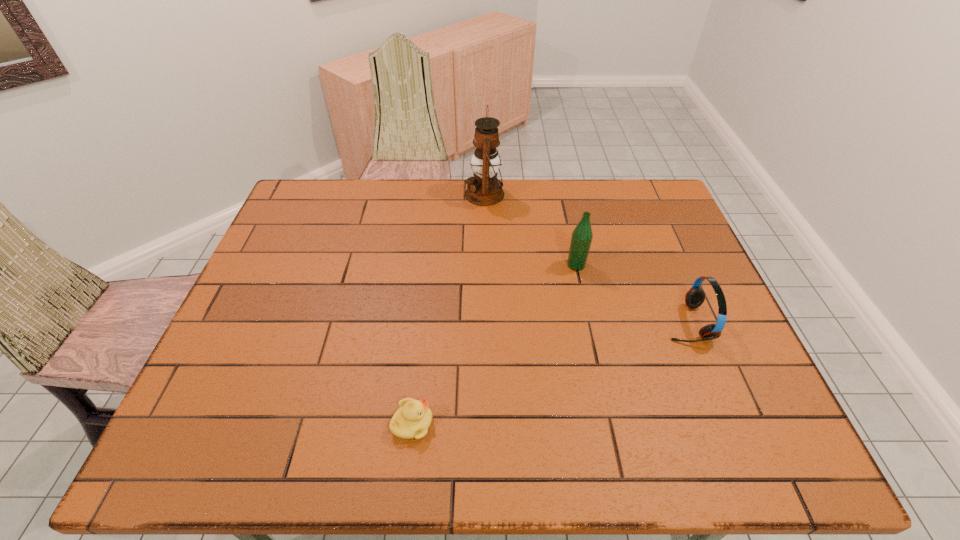
Image resolution: width=960 pixels, height=540 pixels. What are the coordinates of `free spot between the second object from right to left and the third tallest object` in the screenshot? It's located at (631, 294).

Identify the location of free space between the second farthest object and the headset. 631,294.

Where is `the third closest object to the leftmost object`? This screenshot has width=960, height=540. the third closest object to the leftmost object is located at coordinates (484, 189).

Identify which object is located as the nearest to the lantern. Please provide its 2D coordinates. Your answer should be formatted as a tuple, i.e. [(x, y)], where the tuple contains the x and y coordinates of a point satisfying the conditions above.

[(581, 239)]

I want to click on free space in the image that satisfies the following two spatial constraints: 1. on the side of the farthest object, there is a wick adjustment knob; 2. on the left side of the second tallest object, so click(x=486, y=265).

Locate an element on the screen. The image size is (960, 540). free location that satisfies the following two spatial constraints: 1. on the back side of the bottle; 2. on the side of the lantern, there is a wick adjustment knob is located at coordinates (561, 194).

Where is `free space that satisfies the following two spatial constraints: 1. on the side of the lantern, there is a wick adjustment knob; 2. on the right side of the third shortest object`? free space that satisfies the following two spatial constraints: 1. on the side of the lantern, there is a wick adjustment knob; 2. on the right side of the third shortest object is located at coordinates (486, 265).